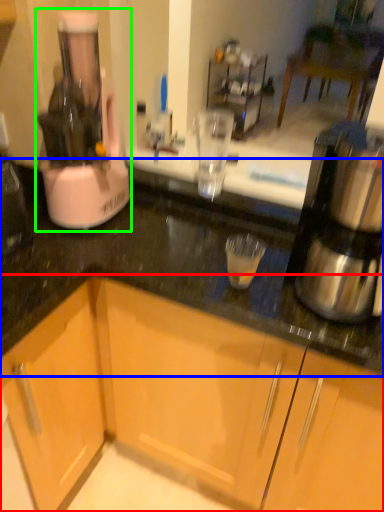
Question: Which object is the closest to the cabinetry (highlighted by a red box)? Choose among these: countertop (highlighted by a blue box) or home appliance (highlighted by a green box).

Choices:
 (A) countertop
 (B) home appliance

Answer: (A)